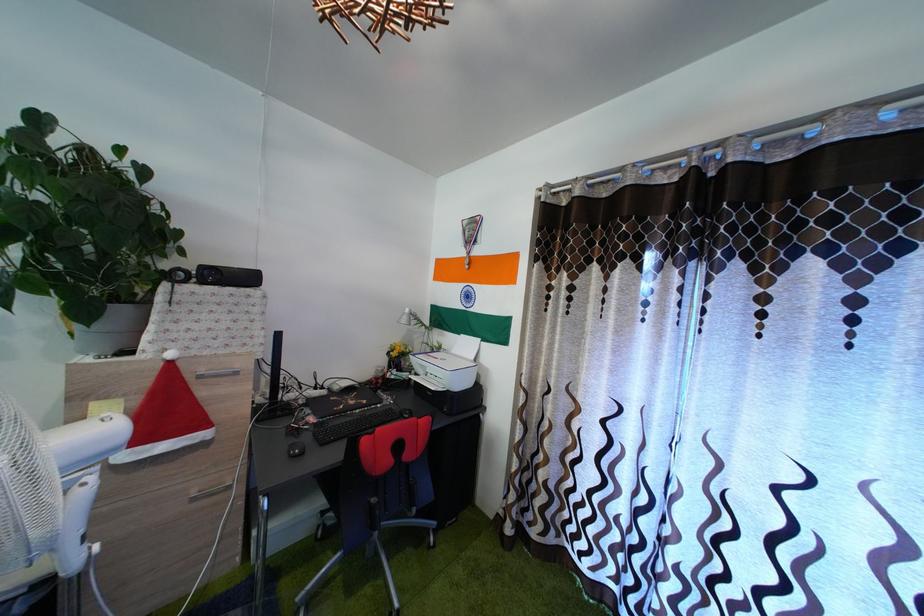
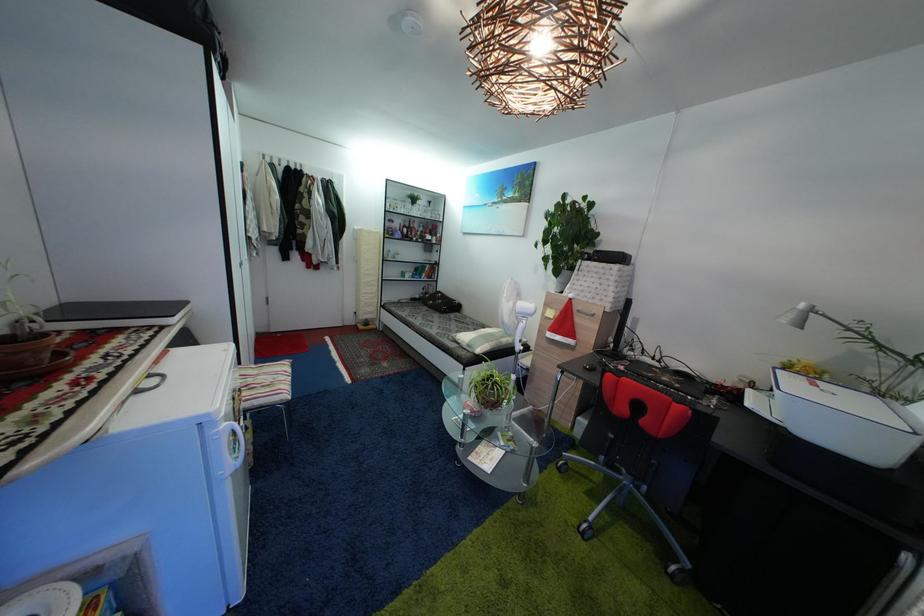
Question: The camera is either moving clockwise (left) or counter-clockwise (right) around the object. The first image is from the beginning of the video and the second image is from the end. Is the camera moving left or right when shooting the video?

Choices:
 (A) Left
 (B) Right

Answer: (B)